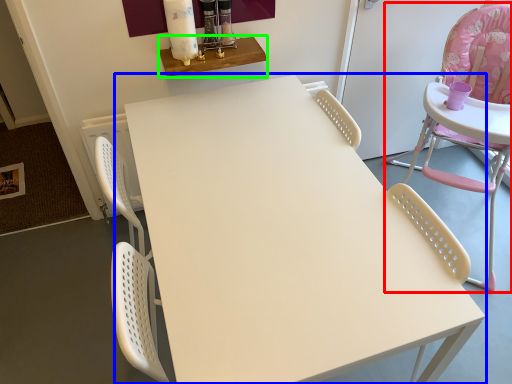
Question: Considering the real-world distances, which object is farthest from chair (highlighted by a red box)? table (highlighted by a blue box) or table (highlighted by a green box)?

Choices:
 (A) table
 (B) table

Answer: (B)